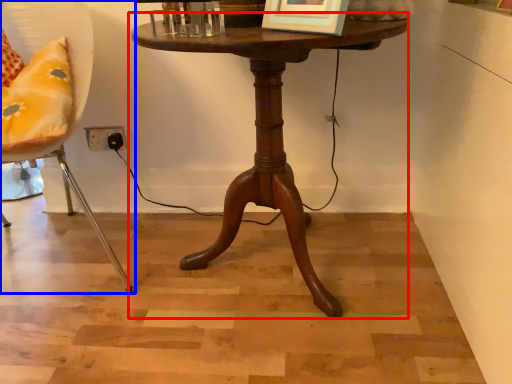
Question: Which point is further to the camera, table (highlighted by a red box) or chair (highlighted by a blue box)?

Choices:
 (A) table
 (B) chair

Answer: (A)